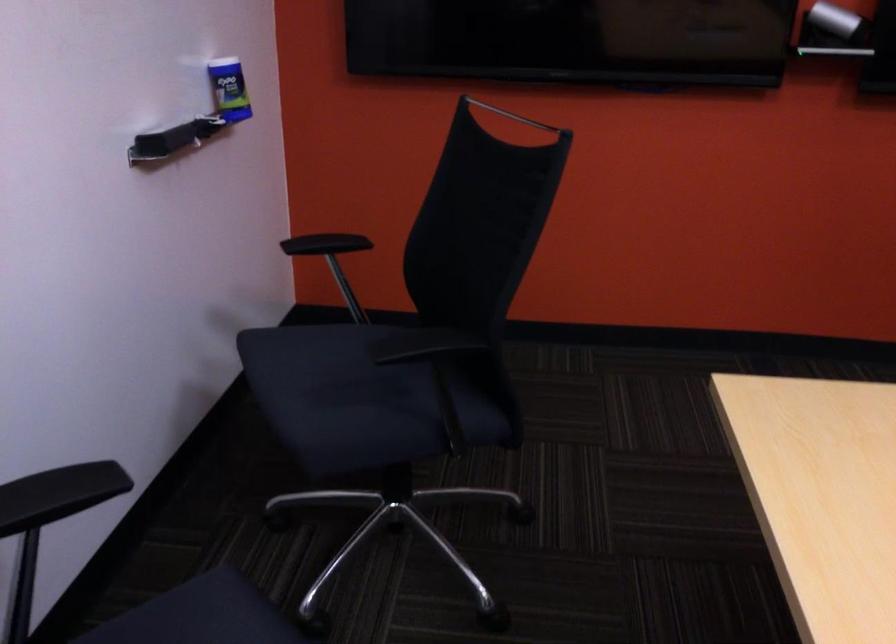
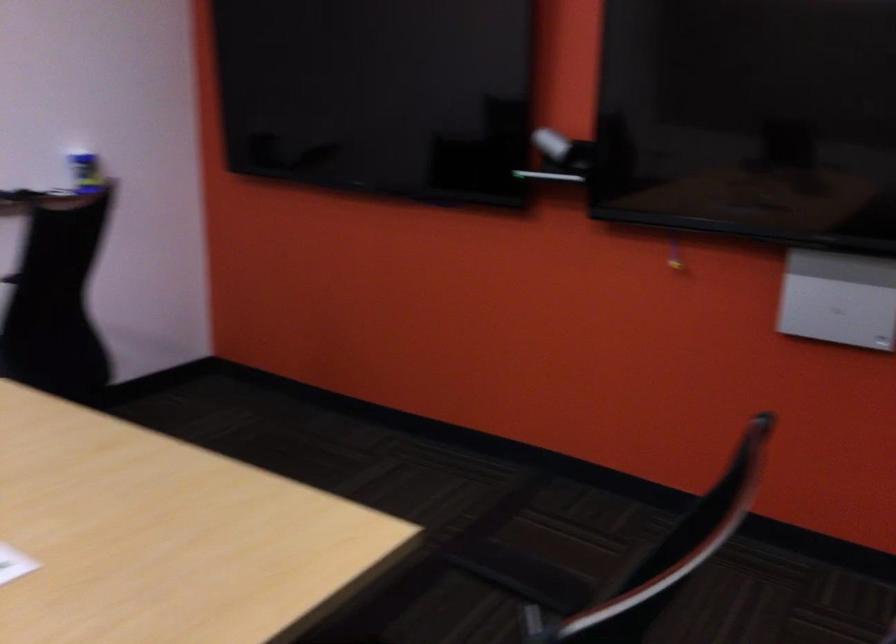
Where in the second image is the point corresponding to point (247, 111) from the first image?

(85, 172)